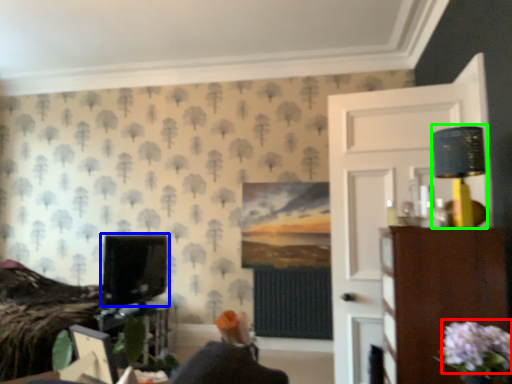
Question: Estimate the real-world distances between objects in this image. Which object is closer to flower (highlighted by a red box), computer monitor (highlighted by a blue box) or table lamp (highlighted by a green box)?

Choices:
 (A) computer monitor
 (B) table lamp

Answer: (B)